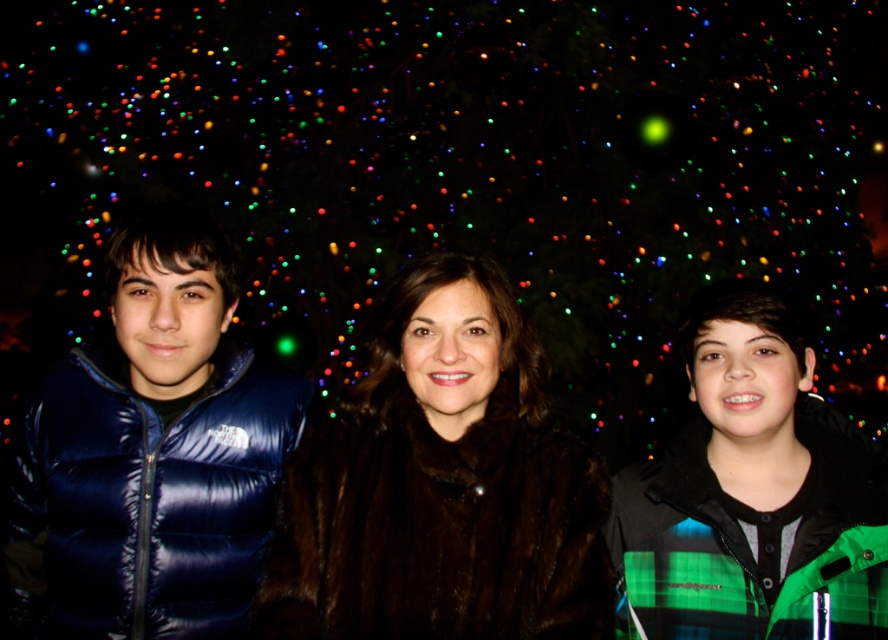
Question: Considering the relative positions of shiny blue vest at left and green plaid jacket at center in the image provided, where is shiny blue vest at left located with respect to green plaid jacket at center?

Choices:
 (A) left
 (B) right

Answer: (A)

Question: Is brown fur coat at center below shiny blue vest at left?

Choices:
 (A) no
 (B) yes

Answer: (B)

Question: Which of the following is the closest to the observer?

Choices:
 (A) shiny blue vest at left
 (B) green plaid jacket at center

Answer: (B)

Question: Can you confirm if brown fur coat at center is wider than shiny blue vest at left?

Choices:
 (A) yes
 (B) no

Answer: (A)

Question: Considering the real-world distances, which object is closest to the brown fur coat at center?

Choices:
 (A) green plaid jacket at center
 (B) shiny blue vest at left

Answer: (A)

Question: Which point is farther to the camera?

Choices:
 (A) green plaid jacket at center
 (B) shiny blue vest at left
 (C) brown fur coat at center

Answer: (B)